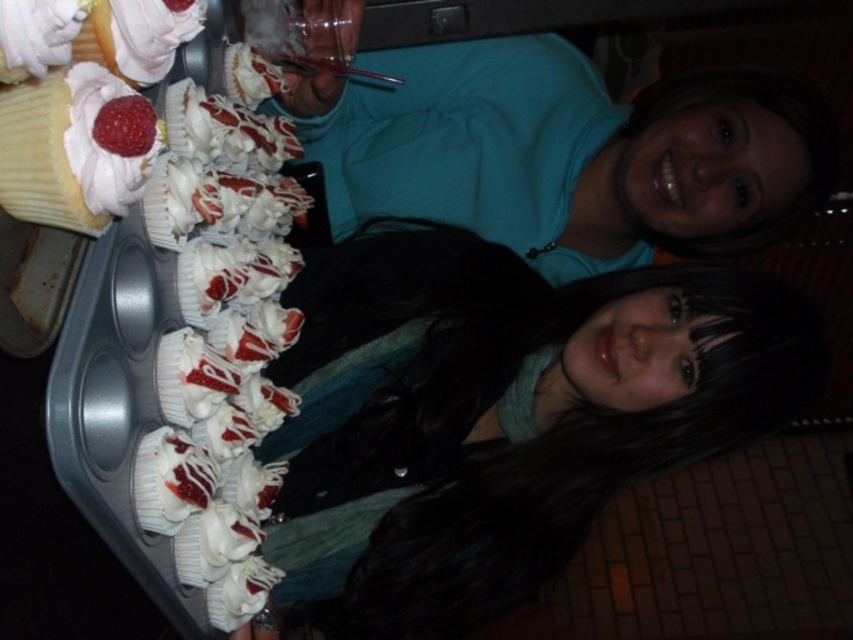
Looking at this image, you are at a party and want to grab a cupcake. The matte white cupcakes at lower left and the white glossy frosting at center are both in front of you. Which one is closer to you?

The matte white cupcakes at lower left are closer to you since they are only 26.47 inches away from the white glossy frosting at center, but the exact distance from you isn